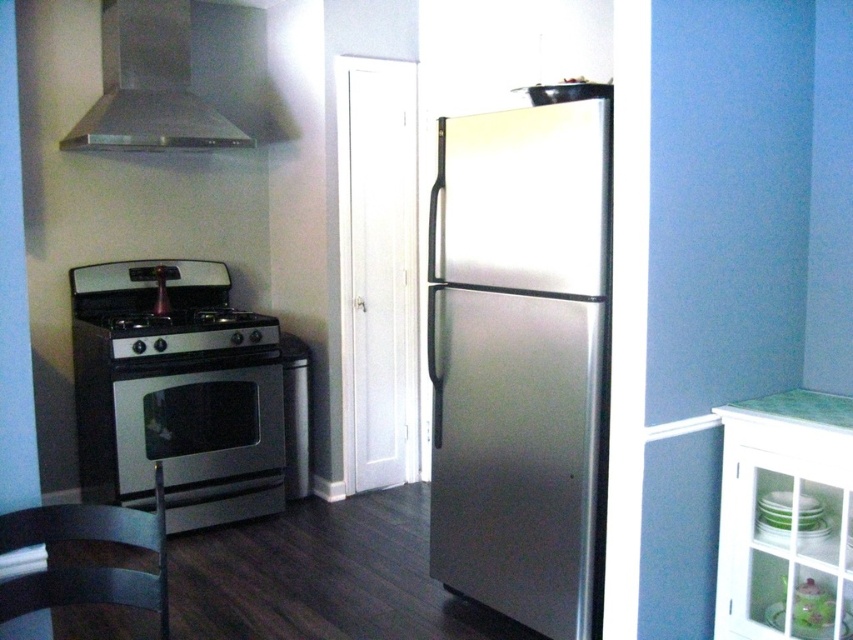
Between stainless steel refrigerator at center and satin silver exhaust hood at upper left, which one is positioned higher?

satin silver exhaust hood at upper left is above.

Does point (456, 276) come closer to viewer compared to point (113, 84)?

Yes, point (456, 276) is closer to viewer.

At what (x,y) coordinates should I click in order to perform the action: click on stainless steel refrigerator at center. Please return your answer as a coordinate pair (x, y). Image resolution: width=853 pixels, height=640 pixels. Looking at the image, I should click on (521, 362).

Between satin silver exhaust hood at upper left and satin silver stove at left, which one appears on the right side from the viewer's perspective?

From the viewer's perspective, satin silver stove at left appears more on the right side.

Is satin silver exhaust hood at upper left shorter than satin silver stove at left?

Incorrect, satin silver exhaust hood at upper left's height does not fall short of satin silver stove at left's.

Measure the distance between satin silver exhaust hood at upper left and camera.

A distance of 10.98 feet exists between satin silver exhaust hood at upper left and camera.

Find the location of a particular element. Image resolution: width=853 pixels, height=640 pixels. satin silver exhaust hood at upper left is located at coordinates (149, 84).

Can you confirm if stainless steel refrigerator at center is positioned below satin silver stove at left?

Yes.

The width and height of the screenshot is (853, 640). What do you see at coordinates (521, 362) in the screenshot? I see `stainless steel refrigerator at center` at bounding box center [521, 362].

In the scene shown: Who is more distant from viewer, (x=602, y=157) or (x=111, y=339)?

Positioned behind is point (x=111, y=339).

Find the location of `stainless steel refrigerator at center`. stainless steel refrigerator at center is located at coordinates (521, 362).